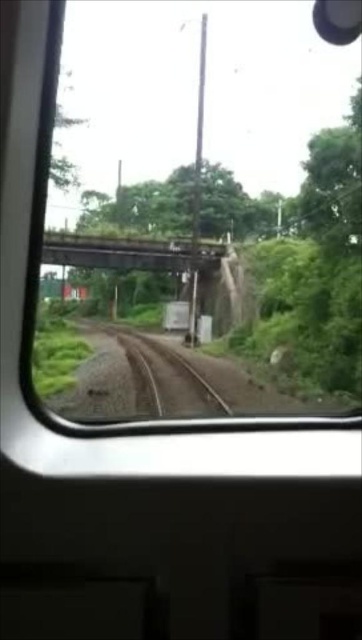
How far apart are brown gravel train track at center and metal bridge at center?

brown gravel train track at center and metal bridge at center are 6.64 meters apart.

You are a GUI agent. You are given a task and a screenshot of the screen. Output one action in this format:
    pyautogui.click(x=<x>, y=<y>)
    Task: Click on the brown gravel train track at center
    The width and height of the screenshot is (362, 640).
    Given the screenshot: What is the action you would take?
    (140, 378)